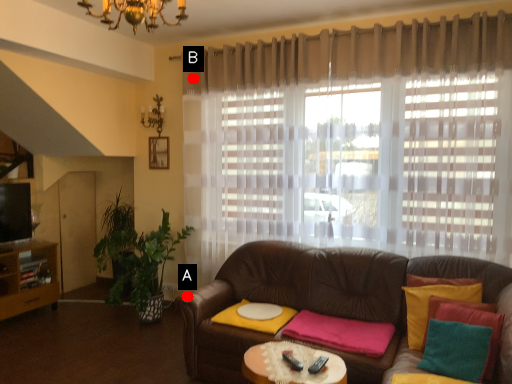
Question: Two points are circled on the image, labeled by A and B beside each circle. Which point is closer to the camera?

Choices:
 (A) A is closer
 (B) B is closer

Answer: (A)